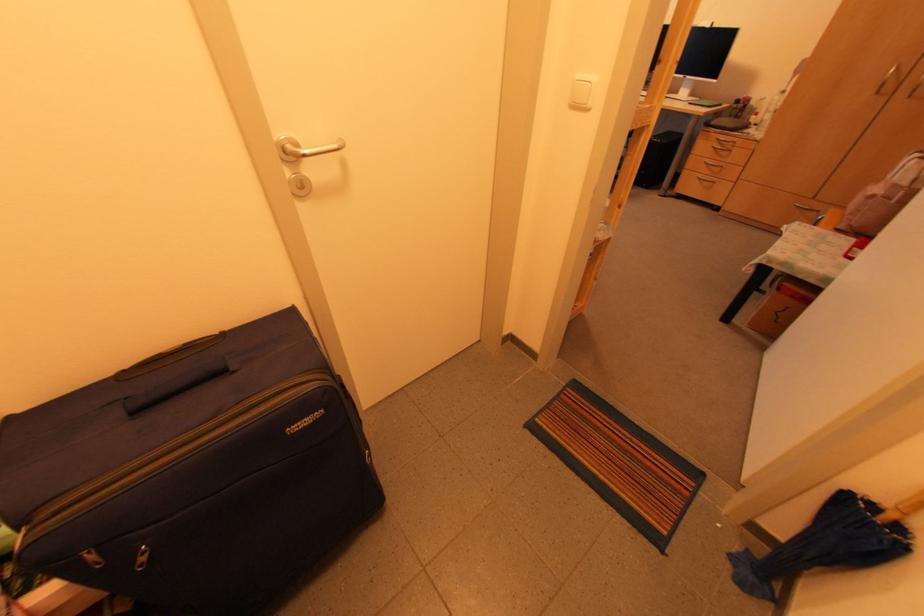
You are a GUI agent. You are given a task and a screenshot of the screen. Output one action in this format:
    pyautogui.click(x=<x>, y=<y>)
    Task: Click on the suitcase handle
    This screenshot has height=616, width=924.
    Given the screenshot: What is the action you would take?
    pyautogui.click(x=176, y=386)